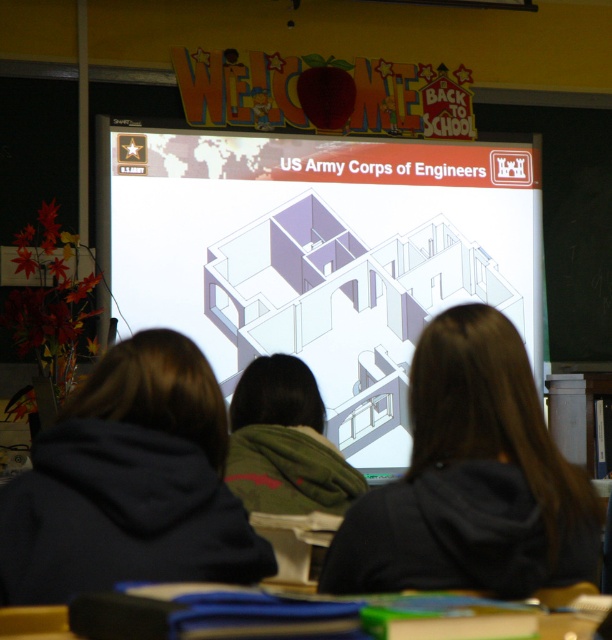
Question: In this image, where is dark gray hoodie at center located relative to black matte hair at center?

Choices:
 (A) left
 (B) right

Answer: (A)

Question: Which object is the farthest from the black matte hair at center?

Choices:
 (A) dark gray hoodie at center
 (B) white glossy projection screen at upper center

Answer: (B)

Question: Among these points, which one is nearest to the camera?

Choices:
 (A) (198, 288)
 (B) (244, 552)
 (C) (304, 388)
 (D) (341, 541)

Answer: (B)

Question: Does white glossy projection screen at upper center have a lesser width compared to black matte hair at center?

Choices:
 (A) no
 (B) yes

Answer: (A)

Question: Can you confirm if white glossy projection screen at upper center is positioned below green matte jacket at center?

Choices:
 (A) yes
 (B) no

Answer: (B)

Question: Estimate the real-world distances between objects in this image. Which object is closer to the dark gray hoodie at center?

Choices:
 (A) white glossy projection screen at upper center
 (B) green matte jacket at center
 (C) black matte hair at center

Answer: (C)